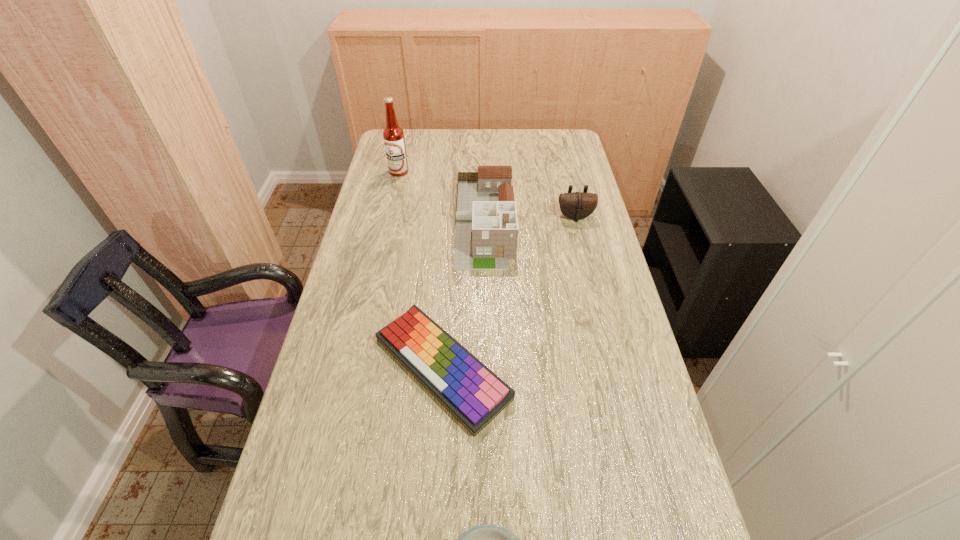
Image resolution: width=960 pixels, height=540 pixels. Find the location of `free space that satisfies the following two spatial constraints: 1. on the label side of the computer keyboard; 2. on the right side of the farthest object`. free space that satisfies the following two spatial constraints: 1. on the label side of the computer keyboard; 2. on the right side of the farthest object is located at coordinates (354, 368).